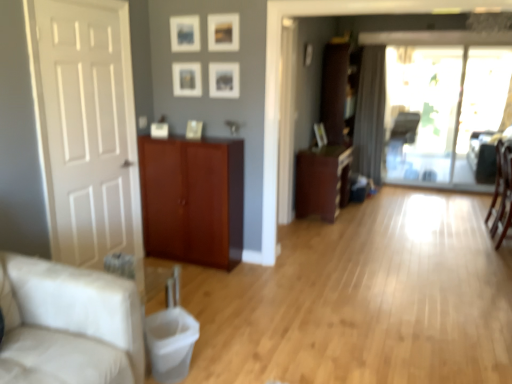
What is the approximate height of mahogany wood cabinet at center, the first cabinetry from the left?

mahogany wood cabinet at center, the first cabinetry from the left, is 1.05 meters tall.

At what (x,y) coordinates should I click in order to perform the action: click on brown wood cabinet at center, the third cabinetry positioned from the left. Please return your answer as a coordinate pair (x, y). The image size is (512, 384). Looking at the image, I should click on (339, 89).

I want to click on matte black armchair at center, so click(401, 137).

Image resolution: width=512 pixels, height=384 pixels. In order to click on transparent glass door at center in this screenshot , I will do `click(443, 108)`.

From the picture: Measure the distance between gray fabric curtain at center and camera.

gray fabric curtain at center is 19.07 feet away from camera.

Where is `wooden chair at right`? wooden chair at right is located at coordinates [x=502, y=192].

Which point is more distant from viewer, (378, 152) or (203, 208)?

The point (378, 152) is behind.

This screenshot has width=512, height=384. What are the coordinates of `curtain above the mahogany wood cabinet at center, which appears as the 1th cabinetry when viewed from the front (from the image's perspective)` in the screenshot? It's located at (370, 115).

From a real-world perspective, between gray fabric curtain at center and mahogany wood cabinet at center, the 3th cabinetry in the back-to-front sequence, who is vertically higher?

In real-world perspective, gray fabric curtain at center is above.

Considering the sizes of objects mahogany wood cabinet at center, which appears as the 1th cabinetry when viewed from the front, and wooden chair at right in the image provided, who is wider, mahogany wood cabinet at center, which appears as the 1th cabinetry when viewed from the front, or wooden chair at right?

mahogany wood cabinet at center, which appears as the 1th cabinetry when viewed from the front.

Identify the location of chair below the mahogany wood cabinet at center, the 3th cabinetry in the back-to-front sequence (from a real-world perspective). The width and height of the screenshot is (512, 384). (502, 192).

Which is closer, (198, 202) or (495, 186)?

Point (198, 202) is closer to the camera than point (495, 186).

From a real-world perspective, between mahogany wood cabinet at center, which is the third cabinetry from right to left, and wooden chair at right, who is vertically higher?

In real-world perspective, mahogany wood cabinet at center, which is the third cabinetry from right to left, is above.

Is transparent glass door at center further to camera compared to mahogany wood cabinet at center, which appears as the 1th cabinetry when viewed from the front?

Yes, the depth of transparent glass door at center is greater than that of mahogany wood cabinet at center, which appears as the 1th cabinetry when viewed from the front.

From the image's perspective, which is above, transparent glass door at center or mahogany wood cabinet at center, the 3th cabinetry in the back-to-front sequence?

transparent glass door at center is shown above in the image.

Locate an element on the screen. The image size is (512, 384). the 2nd cabinetry below the transparent glass door at center (from the image's perspective) is located at coordinates (193, 200).

Is transparent glass door at center next to mahogany wood cabinet at center, the 3th cabinetry in the back-to-front sequence?

transparent glass door at center and mahogany wood cabinet at center, the 3th cabinetry in the back-to-front sequence, are not in contact.

Does matte black armchair at center touch mahogany wood cabinet at center, which is the third cabinetry from right to left?

They are not placed beside each other.

Consider the image. Could you tell me if matte black armchair at center is turned towards mahogany wood cabinet at center, which is the third cabinetry from right to left?

Yes, matte black armchair at center faces towards mahogany wood cabinet at center, which is the third cabinetry from right to left.

Does matte black armchair at center appear on the left side of mahogany wood cabinet at center, which is the third cabinetry from right to left?

In fact, matte black armchair at center is to the right of mahogany wood cabinet at center, which is the third cabinetry from right to left.

Which is in front, matte black armchair at center or mahogany wood cabinet at center, the first cabinetry from the left?

Positioned in front is mahogany wood cabinet at center, the first cabinetry from the left.

Is brown wood cabinet at center, the first cabinetry when ordered from back to front, inside or outside of white matte door at left?

brown wood cabinet at center, the first cabinetry when ordered from back to front, is not inside white matte door at left, it's outside.

Looking at their sizes, would you say brown wood cabinet at center, which is counted as the 3th cabinetry, starting from the front, is wider or thinner than white matte door at left?

brown wood cabinet at center, which is counted as the 3th cabinetry, starting from the front, is wider than white matte door at left.

Considering the relative sizes of brown wood cabinet at center, the first cabinetry when ordered from back to front, and white matte door at left in the image provided, is brown wood cabinet at center, the first cabinetry when ordered from back to front, bigger than white matte door at left?

Yes, brown wood cabinet at center, the first cabinetry when ordered from back to front, is bigger than white matte door at left.

Is white matte door at left at the back of brown wood cabinet at center, which is counted as the 3th cabinetry, starting from the front?

No, brown wood cabinet at center, which is counted as the 3th cabinetry, starting from the front,'s orientation is not away from white matte door at left.

Is the surface of transparent glass door at center in direct contact with brown wood cabinet at center, marked as the 1th cabinetry in a right-to-left arrangement?

No.

Can you tell me how much transparent glass door at center and brown wood cabinet at center, the first cabinetry when ordered from back to front, differ in facing direction?

There is a 90.6-degree angle between the facing directions of transparent glass door at center and brown wood cabinet at center, the first cabinetry when ordered from back to front.

Can you confirm if transparent glass door at center is smaller than brown wood cabinet at center, the third cabinetry positioned from the left?

Yes, transparent glass door at center is smaller than brown wood cabinet at center, the third cabinetry positioned from the left.

Can you confirm if brown wood cabinet at center, marked as the 1th cabinetry in a right-to-left arrangement, is smaller than beige fabric couch at left?

Indeed, brown wood cabinet at center, marked as the 1th cabinetry in a right-to-left arrangement, has a smaller size compared to beige fabric couch at left.

Could you tell me if brown wood cabinet at center, the third cabinetry positioned from the left, is turned towards beige fabric couch at left?

No, brown wood cabinet at center, the third cabinetry positioned from the left, is not turned towards beige fabric couch at left.

Is point (328, 72) farther from camera compared to point (0, 373)?

Yes.

At what (x,y) coordinates should I click in order to perform the action: click on cabinetry that is the 3rd object located below the gray fabric curtain at center (from the image's perspective). Please return your answer as a coordinate pair (x, y). The height and width of the screenshot is (384, 512). Looking at the image, I should click on (193, 200).

Find the location of a particular element. Image resolution: width=512 pixels, height=384 pixels. chair lying on the right of mahogany wood cabinet at center, which is the third cabinetry from right to left is located at coordinates (502, 192).

From the image, which object appears to be farther from matte wood cabinet at center, the 2th cabinetry when ordered from right to left, white matte door at left or mahogany wood cabinet at center, the 3th cabinetry in the back-to-front sequence?

white matte door at left lies further to matte wood cabinet at center, the 2th cabinetry when ordered from right to left, than the other object.

When comparing their distances from white matte door at left, does wooden chair at right or brown wood cabinet at center, the third cabinetry positioned from the left, seem closer?

Based on the image, brown wood cabinet at center, the third cabinetry positioned from the left, appears to be nearer to white matte door at left.

Estimate the real-world distances between objects in this image. Which object is further from matte black armchair at center, matte wood cabinet at center, the 2th cabinetry when ordered from right to left, or mahogany wood cabinet at center, the 3th cabinetry in the back-to-front sequence?

Among the two, mahogany wood cabinet at center, the 3th cabinetry in the back-to-front sequence, is located further to matte black armchair at center.

Based on the photo, from the image, which object appears to be nearer to matte black armchair at center, brown wood cabinet at center, the third cabinetry positioned from the left, or gray fabric curtain at center?

gray fabric curtain at center.

From the picture: When comparing their distances from brown wood cabinet at center, the third cabinetry positioned from the left, does transparent glass door at center or gray fabric curtain at center seem further?

The object further to brown wood cabinet at center, the third cabinetry positioned from the left, is transparent glass door at center.

Estimate the real-world distances between objects in this image. Which object is further from mahogany wood cabinet at center, which is the third cabinetry from right to left, beige fabric couch at left or matte wood cabinet at center, the 2th cabinetry when ordered from right to left?

Among the two, beige fabric couch at left is located further to mahogany wood cabinet at center, which is the third cabinetry from right to left.

Based on their spatial positions, is beige fabric couch at left or transparent glass door at center closer to gray fabric curtain at center?

transparent glass door at center is positioned closer to the anchor gray fabric curtain at center.

Based on their spatial positions, is gray fabric curtain at center or matte wood cabinet at center, which ranks as the second cabinetry in back-to-front order, further from matte black armchair at center?

Based on the image, matte wood cabinet at center, which ranks as the second cabinetry in back-to-front order, appears to be further to matte black armchair at center.

Locate an element on the screen. Image resolution: width=512 pixels, height=384 pixels. chair positioned between beige fabric couch at left and matte wood cabinet at center, placed as the second cabinetry when sorted from front to back, from near to far is located at coordinates (502, 192).

Find the location of a particular element. The image size is (512, 384). chair between matte wood cabinet at center, which ranks as the second cabinetry in back-to-front order, and transparent glass door at center from left to right is located at coordinates tap(502, 192).

At what (x,y) coordinates should I click in order to perform the action: click on window between mahogany wood cabinet at center, the first cabinetry from the left, and matte black armchair at center from front to back. Please return your answer as a coordinate pair (x, y). The width and height of the screenshot is (512, 384). Looking at the image, I should click on (443, 108).

Image resolution: width=512 pixels, height=384 pixels. I want to click on window between brown wood cabinet at center, marked as the 1th cabinetry in a right-to-left arrangement, and matte black armchair at center, along the z-axis, so click(443, 108).